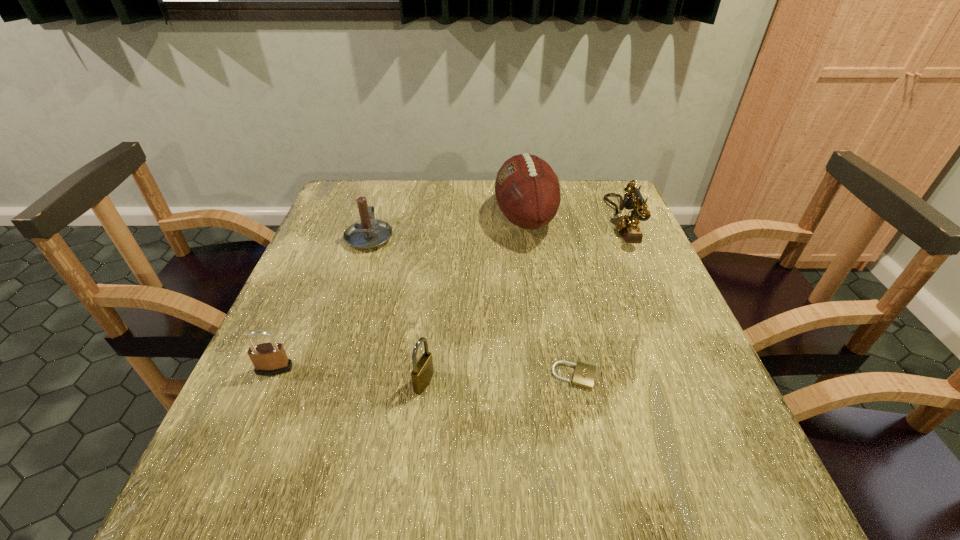
In order to click on padlock that is at the left edge in this screenshot , I will do `click(269, 359)`.

This screenshot has height=540, width=960. In order to click on object that is at the right edge in this screenshot , I will do `click(628, 225)`.

Image resolution: width=960 pixels, height=540 pixels. What are the coordinates of `object positioned at the far left corner` in the screenshot? It's located at (367, 233).

Identify the location of object that is at the far right corner. The width and height of the screenshot is (960, 540). click(628, 225).

In the image, there is a desktop. At what (x,y) coordinates should I click in order to perform the action: click on vacant region at the far edge. Please return your answer as a coordinate pair (x, y). The image size is (960, 540). Looking at the image, I should click on (x=487, y=198).

Where is `vacant area at the near edge`? This screenshot has width=960, height=540. vacant area at the near edge is located at coordinates (422, 518).

This screenshot has width=960, height=540. I want to click on vacant area at the right edge, so click(x=636, y=269).

In order to click on vacant area at the far left corner of the desktop in this screenshot , I will do `click(379, 193)`.

Identify the location of vacant space at the far right corner of the desktop. (608, 198).

In order to click on vacant space that is in between the leftmost padlock and the fifth object from right to left in this screenshot , I will do `click(323, 303)`.